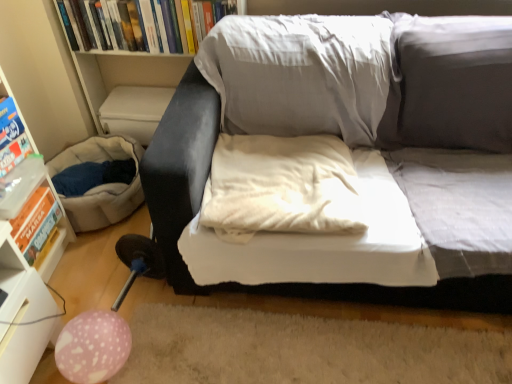
Question: From a real-world perspective, is white plastic shelf at left positioned under beige fabric bean bag at lower left based on gravity?

Choices:
 (A) yes
 (B) no

Answer: (B)

Question: Would you say white plastic shelf at left is a long distance from beige fabric bean bag at lower left?

Choices:
 (A) no
 (B) yes

Answer: (A)

Question: Is white plastic shelf at left to the left of beige fabric bean bag at lower left from the viewer's perspective?

Choices:
 (A) no
 (B) yes

Answer: (B)

Question: Could you tell me if white plastic shelf at left is turned towards beige fabric bean bag at lower left?

Choices:
 (A) no
 (B) yes

Answer: (A)

Question: Can you confirm if white plastic shelf at left is wider than beige fabric bean bag at lower left?

Choices:
 (A) no
 (B) yes

Answer: (A)

Question: Can beige fabric bean bag at lower left be found inside white plastic shelf at left?

Choices:
 (A) no
 (B) yes

Answer: (A)

Question: Considering the relative sizes of matte blue paperback book at left, the second paperback book ordered from the bottom, and white plastic shelf at left in the image provided, is matte blue paperback book at left, the second paperback book ordered from the bottom, smaller than white plastic shelf at left?

Choices:
 (A) no
 (B) yes

Answer: (B)

Question: From the image's perspective, is matte blue paperback book at left, which ranks as the second paperback book in top-to-bottom order, on top of white plastic shelf at left?

Choices:
 (A) no
 (B) yes

Answer: (B)

Question: Is matte blue paperback book at left, which ranks as the second paperback book in top-to-bottom order, at the right side of white plastic shelf at left?

Choices:
 (A) yes
 (B) no

Answer: (A)

Question: From a real-world perspective, does matte blue paperback book at left, the second paperback book ordered from the bottom, stand above white plastic shelf at left?

Choices:
 (A) yes
 (B) no

Answer: (A)

Question: Is white plastic shelf at left a part of matte blue paperback book at left, which ranks as the second paperback book in top-to-bottom order?

Choices:
 (A) yes
 (B) no

Answer: (B)

Question: From a real-world perspective, is matte blue paperback book at left, the second paperback book ordered from the bottom, located beneath white plastic shelf at left?

Choices:
 (A) no
 (B) yes

Answer: (A)

Question: From a real-world perspective, is beige fabric bean bag at lower left positioned over matte gray couch at center based on gravity?

Choices:
 (A) yes
 (B) no

Answer: (B)